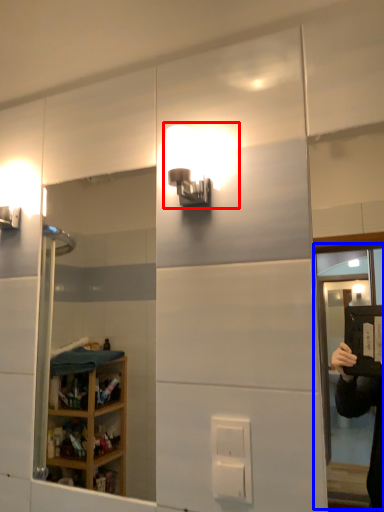
Question: Which object appears farthest to the camera in this image, light fixture (highlighted by a red box) or screen door (highlighted by a blue box)?

Choices:
 (A) light fixture
 (B) screen door

Answer: (A)